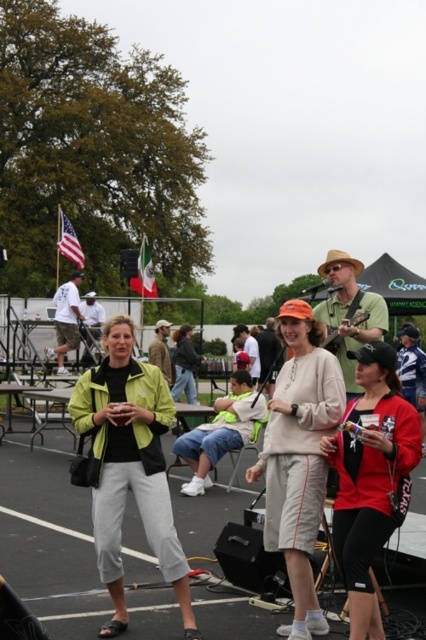
Is green textured shirt at center positioned behind red fabric flag at center?

No, it is in front of red fabric flag at center.

Can you confirm if green textured shirt at center is taller than red fabric flag at center?

No, green textured shirt at center is not taller than red fabric flag at center.

Between point (336, 326) and point (149, 256), which one is positioned in front?

Positioned in front is point (336, 326).

Find the location of a particular element. This screenshot has height=640, width=426. green textured shirt at center is located at coordinates (350, 310).

Is light beige cotton shorts at center above red matte jacket at center?

Yes.

Does point (302, 484) come in front of point (380, 344)?

No, (302, 484) is further to viewer.

This screenshot has height=640, width=426. I want to click on light beige cotton shorts at center, so click(299, 458).

Between light beige cotton shorts at center and matte black baseball cap at center, which one is positioned higher?

light beige cotton shorts at center is higher up.

Consider the image. How far apart are light beige cotton shorts at center and matte black baseball cap at center?

The distance of light beige cotton shorts at center from matte black baseball cap at center is 11.63 meters.

Is point (294, 339) positioned behind point (253, 380)?

No, it is not.

This screenshot has width=426, height=640. I want to click on light beige cotton shorts at center, so click(299, 458).